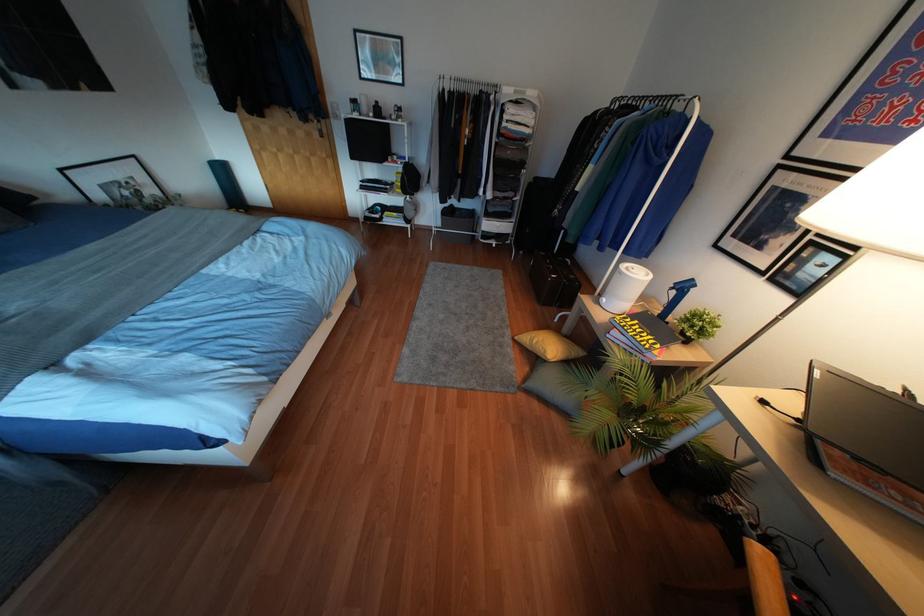
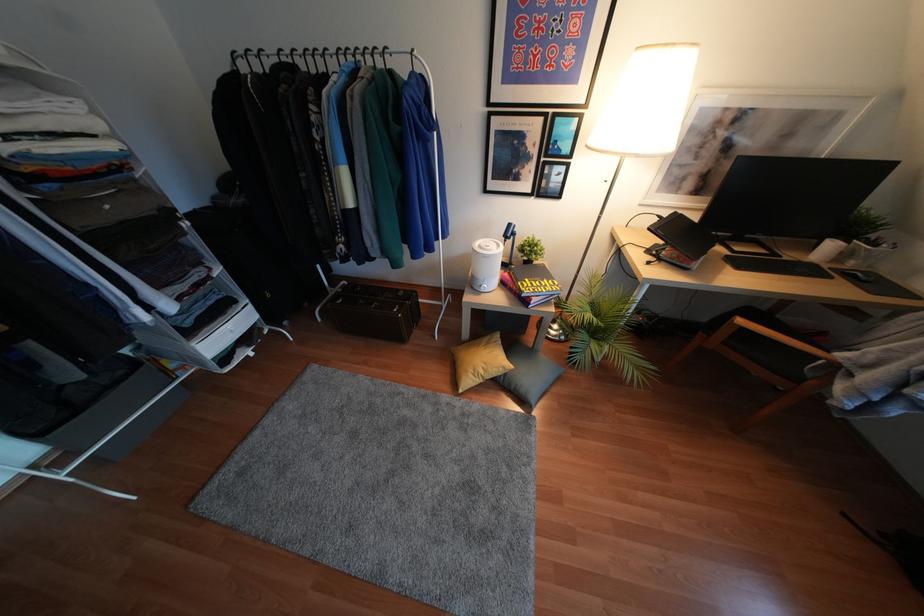
Find the pixel in the second image that matches the point at 507,331 in the first image.

(445, 397)